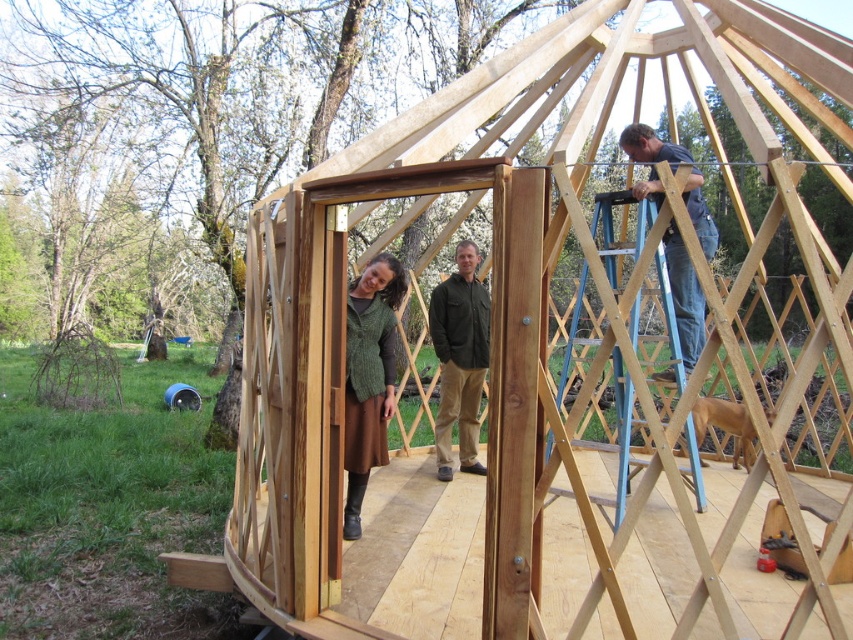
You are a visitor approaching the wooden structure. From your perspective, which object is closer to you between the green knitted sweater at center and the smooth light brown wood at upper right?

The green knitted sweater at center is closer to you because the smooth light brown wood at upper right is behind it.